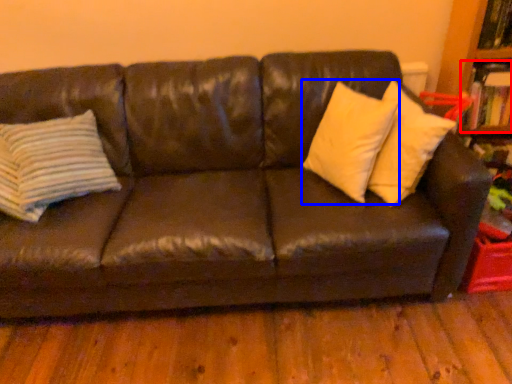
Question: Which point is closer to the camera, book (highlighted by a red box) or pillow (highlighted by a blue box)?

Choices:
 (A) book
 (B) pillow

Answer: (B)